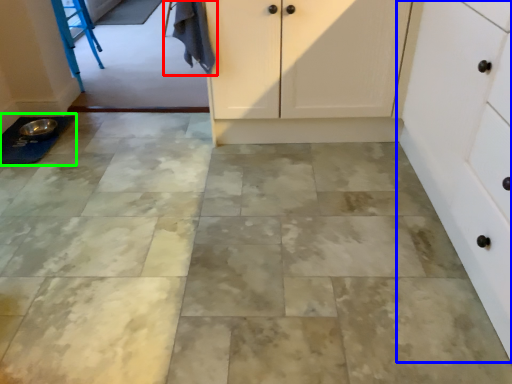
Question: Estimate the real-world distances between objects in this image. Which object is farther from laundry (highlighted by a red box), cabinetry (highlighted by a blue box) or sink (highlighted by a green box)?

Choices:
 (A) cabinetry
 (B) sink

Answer: (A)